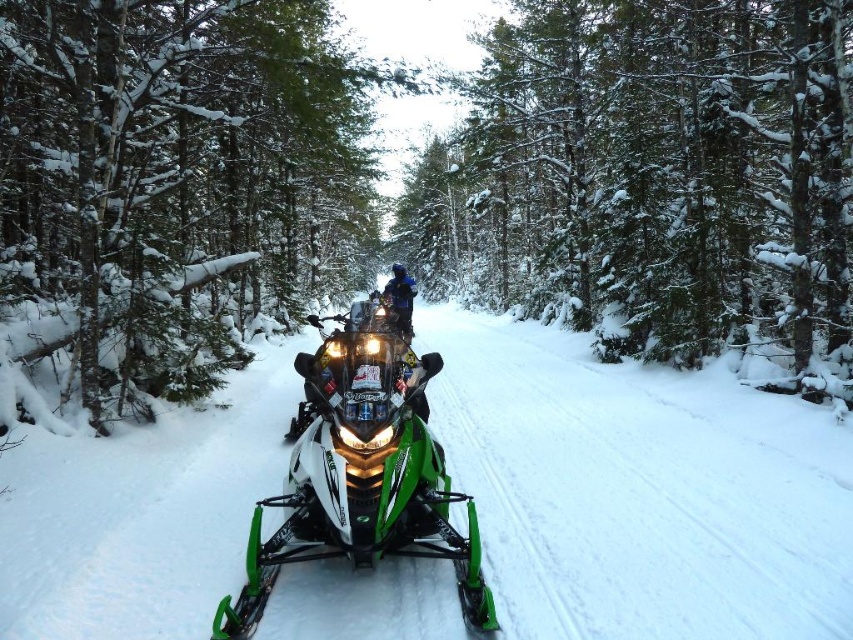
Can you confirm if green matte snowmobile at center is positioned below blue fabric jacket at center?

Indeed, green matte snowmobile at center is positioned under blue fabric jacket at center.

Between green matte snowmobile at center and blue fabric jacket at center, which one appears on the left side from the viewer's perspective?

Positioned to the left is blue fabric jacket at center.

Is point (22, 596) positioned in front of point (401, 280)?

Yes, it is in front of point (401, 280).

The width and height of the screenshot is (853, 640). I want to click on green matte snowmobile at center, so click(640, 490).

Is green textured snowmobile at center to the right of blue fabric jacket at center from the viewer's perspective?

Indeed, green textured snowmobile at center is positioned on the right side of blue fabric jacket at center.

Who is positioned more to the left, green textured snowmobile at center or blue fabric jacket at center?

Positioned to the left is blue fabric jacket at center.

Between point (793, 339) and point (390, 280), which one is positioned in front?

Point (793, 339) is in front.

Locate an element on the screen. The image size is (853, 640). green textured snowmobile at center is located at coordinates (653, 177).

Consider the image. Who is higher up, green matte tree at center or green textured snowmobile at center?

green textured snowmobile at center is higher up.

What do you see at coordinates (173, 193) in the screenshot? I see `green matte tree at center` at bounding box center [173, 193].

You are a GUI agent. You are given a task and a screenshot of the screen. Output one action in this format:
    pyautogui.click(x=<x>, y=<y>)
    Task: Click on the green matte tree at center
    
    Given the screenshot: What is the action you would take?
    pyautogui.click(x=173, y=193)

You are a GUI agent. You are given a task and a screenshot of the screen. Output one action in this format:
    pyautogui.click(x=<x>, y=<y>)
    Task: Click on the green matte tree at center
    Image resolution: width=853 pixels, height=640 pixels.
    Given the screenshot: What is the action you would take?
    pyautogui.click(x=173, y=193)